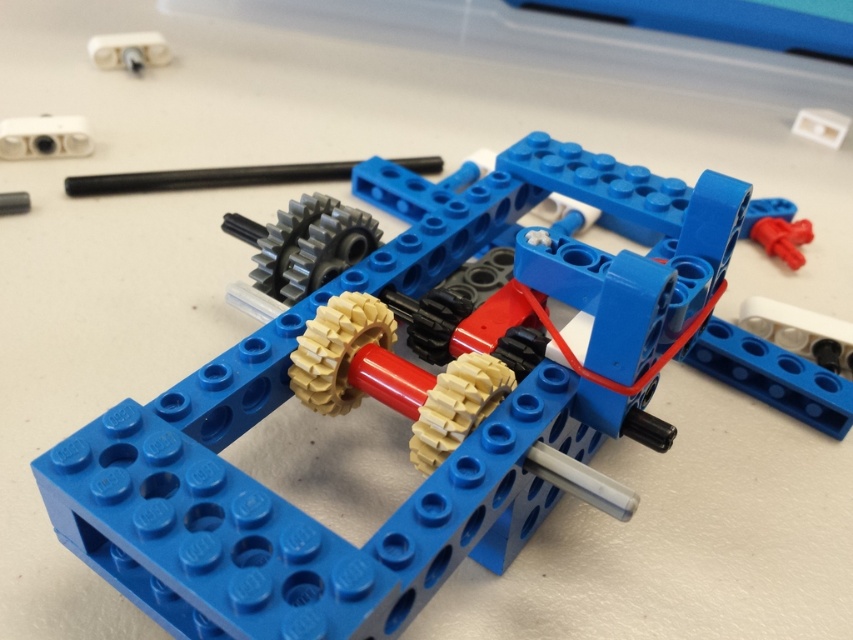
Is white plastic connector at upper left smaller than white plastic hinge at upper right?

Incorrect, white plastic connector at upper left is not smaller in size than white plastic hinge at upper right.

Between point (79, 116) and point (811, 120), which one is positioned behind?

The point (811, 120) is behind.

The height and width of the screenshot is (640, 853). What are the coordinates of `white plastic connector at upper left` in the screenshot? It's located at (44, 136).

Measure the distance from white plastic hinge at upper left to white plastic hinge at upper right.

Answer: white plastic hinge at upper left and white plastic hinge at upper right are 1.38 meters apart.

Can you confirm if white plastic hinge at upper left is bigger than white plastic hinge at upper right?

Indeed, white plastic hinge at upper left has a larger size compared to white plastic hinge at upper right.

Is point (155, 60) in front of point (830, 138)?

No, it is not.

Identify the location of white plastic hinge at upper left. Image resolution: width=853 pixels, height=640 pixels. (128, 51).

Does point (77, 125) come in front of point (144, 61)?

Yes.

Which is in front, point (32, 148) or point (113, 65)?

Positioned in front is point (32, 148).

Describe the element at coordinates (44, 136) in the screenshot. I see `white plastic connector at upper left` at that location.

Where is `white plastic connector at upper left`? white plastic connector at upper left is located at coordinates (44, 136).